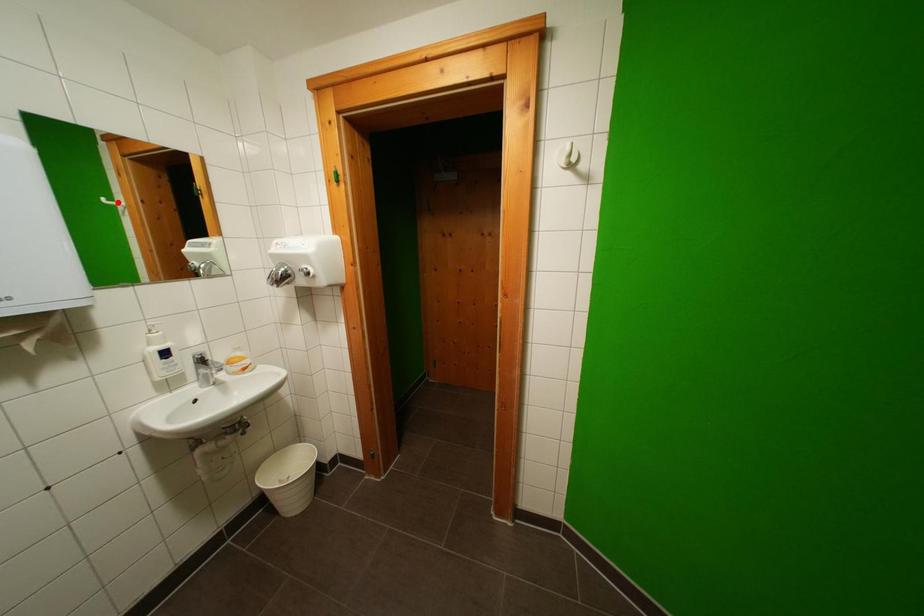
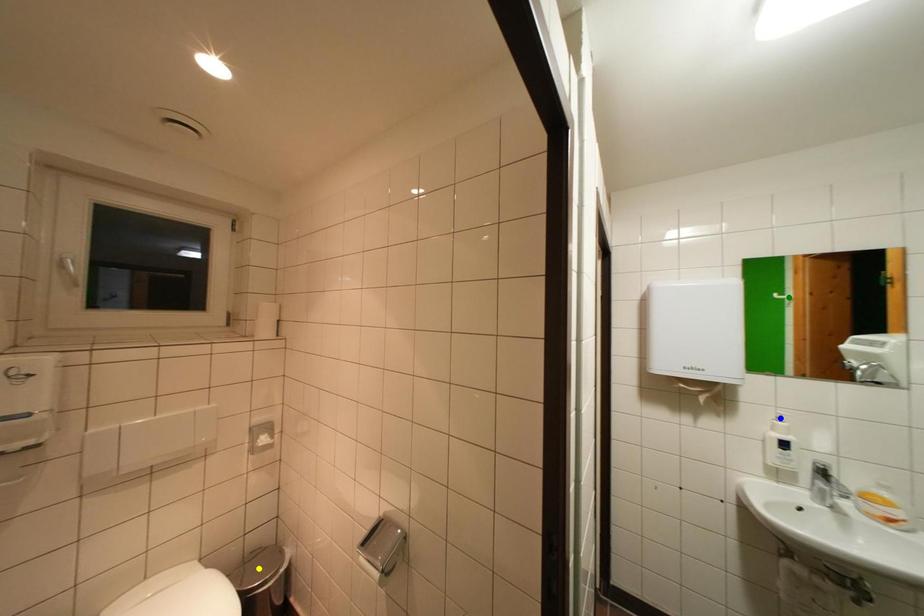
Question: I am providing you with two images of the same scene from different viewpoints. A red point is marked on the first image. You are given multiple points on the second image. Which point in image 2 represents the same 3d spot as the red point in image 1?

Choices:
 (A) blue point
 (B) green point
 (C) yellow point

Answer: (B)